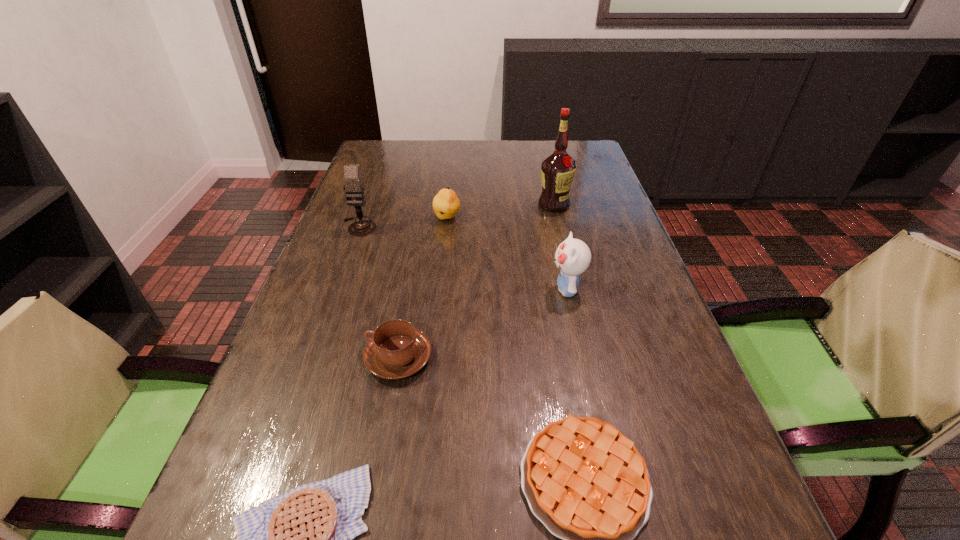
Locate an element on the screen. free location located on the front-facing side of the fourth nearest object is located at coordinates (391, 289).

At what (x,y) coordinates should I click in order to perform the action: click on free region located on the front-facing side of the fourth nearest object. Please return your answer as a coordinate pair (x, y). Looking at the image, I should click on (527, 289).

Find the location of a particular element. The image size is (960, 540). vacant space located on the left of the pear is located at coordinates (396, 218).

You are a GUI agent. You are given a task and a screenshot of the screen. Output one action in this format:
    pyautogui.click(x=<x>, y=<y>)
    Task: Click on the vacant space located on the side of the fifth farthest object with the handle
    This screenshot has height=540, width=960.
    Given the screenshot: What is the action you would take?
    pyautogui.click(x=300, y=357)

The width and height of the screenshot is (960, 540). In order to click on vacant space located 0.070m on the side of the fifth farthest object with the handle in this screenshot , I will do `click(330, 357)`.

This screenshot has width=960, height=540. I want to click on free space located on the side of the fifth farthest object with the handle, so click(x=280, y=357).

Locate an element on the screen. This screenshot has width=960, height=540. object that is at the left edge is located at coordinates (354, 187).

Locate an element on the screen. The width and height of the screenshot is (960, 540). alcohol at the right edge is located at coordinates (557, 169).

The height and width of the screenshot is (540, 960). Find the location of `kitten at the right edge`. kitten at the right edge is located at coordinates (572, 257).

In the image, there is a desktop. At what (x,y) coordinates should I click in order to perform the action: click on vacant region at the far edge. Please return your answer as a coordinate pair (x, y). Looking at the image, I should click on click(x=497, y=147).